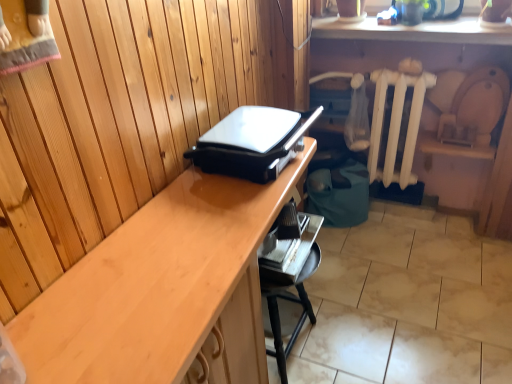
Where is `metallic silver tray at lower center`? The width and height of the screenshot is (512, 384). metallic silver tray at lower center is located at coordinates (289, 280).

This screenshot has height=384, width=512. Find the location of `wooden desk at center`. wooden desk at center is located at coordinates click(164, 291).

I want to click on white painted wood radiator at center right, so click(x=396, y=124).

Describe the element at coordinates (396, 124) in the screenshot. I see `white painted wood radiator at center right` at that location.

The image size is (512, 384). Identify the location of metallic silver tray at lower center. (289, 280).

Who is more distant, wooden desk at center or black plastic grill at center?

black plastic grill at center is behind.

Is wooden desk at center inside the boundaries of black plastic grill at center, or outside?

wooden desk at center cannot be found inside black plastic grill at center.

Considering the relative sizes of wooden desk at center and black plastic grill at center in the image provided, is wooden desk at center bigger than black plastic grill at center?

Correct, wooden desk at center is larger in size than black plastic grill at center.

Are wooden desk at center and black plastic grill at center located far from each other?

No, wooden desk at center is in close proximity to black plastic grill at center.

Can you confirm if metallic silver tray at lower center is smaller than black plastic grill at center?

Incorrect, metallic silver tray at lower center is not smaller in size than black plastic grill at center.

This screenshot has width=512, height=384. In order to click on furniture below the black plastic grill at center (from the image's perspective) in this screenshot , I will do `click(289, 280)`.

Is metallic silver tray at lower center spatially inside black plastic grill at center, or outside of it?

The correct answer is: outside.

How distant is metallic silver tray at lower center from black plastic grill at center?

metallic silver tray at lower center is 16.32 inches away from black plastic grill at center.

Is metallic silver tray at lower center not near white painted wood radiator at center right?

metallic silver tray at lower center is near white painted wood radiator at center right, not far away.

Considering the relative positions of metallic silver tray at lower center and white painted wood radiator at center right in the image provided, is metallic silver tray at lower center behind white painted wood radiator at center right?

No.

From a real-world perspective, which is physically above, metallic silver tray at lower center or white painted wood radiator at center right?

white painted wood radiator at center right.

Which is more to the left, metallic silver tray at lower center or white painted wood radiator at center right?

metallic silver tray at lower center is more to the left.

Based on the photo, is white painted wood radiator at center right not close to wooden desk at center?

Yes, white painted wood radiator at center right and wooden desk at center are located far from each other.

From the picture: Considering the sizes of objects white painted wood radiator at center right and wooden desk at center in the image provided, who is wider, white painted wood radiator at center right or wooden desk at center?

wooden desk at center.

From a real-world perspective, which is physically below, white painted wood radiator at center right or wooden desk at center?

wooden desk at center, from a real-world perspective.

Does point (397, 176) come farther from viewer compared to point (93, 255)?

Yes, it is.

Does point (421, 110) appear closer or farther from the camera than point (282, 276)?

Point (421, 110) is farther from the camera than point (282, 276).

Measure the distance between white painted wood radiator at center right and metallic silver tray at lower center.

white painted wood radiator at center right and metallic silver tray at lower center are 33.04 inches apart from each other.

From a real-world perspective, is white painted wood radiator at center right physically located above or below metallic silver tray at lower center?

Clearly, from a real-world perspective, white painted wood radiator at center right is above metallic silver tray at lower center.

Could you tell me if white painted wood radiator at center right is turned towards metallic silver tray at lower center?

Yes, white painted wood radiator at center right faces towards metallic silver tray at lower center.

From the picture: Does wooden desk at center turn towards white painted wood radiator at center right?

No, wooden desk at center does not turn towards white painted wood radiator at center right.

Considering the positions of point (220, 309) and point (393, 153), is point (220, 309) closer or farther from the camera than point (393, 153)?

Point (220, 309) appears to be closer to the viewer than point (393, 153).

Is wooden desk at center placed right next to white painted wood radiator at center right?

No, wooden desk at center is not beside white painted wood radiator at center right.

From a real-world perspective, between black plastic grill at center and white painted wood radiator at center right, who is vertically lower?

white painted wood radiator at center right.

Considering the positions of objects black plastic grill at center and white painted wood radiator at center right in the image provided, who is in front, black plastic grill at center or white painted wood radiator at center right?

black plastic grill at center is more forward.

Which object is thinner, black plastic grill at center or white painted wood radiator at center right?

With smaller width is white painted wood radiator at center right.

There is a white painted wood radiator at center right. At what (x,y) coordinates should I click in order to perform the action: click on appliance above it (from a real-world perspective). Please return your answer as a coordinate pair (x, y). Looking at the image, I should click on (253, 142).

Image resolution: width=512 pixels, height=384 pixels. In order to click on appliance that appears above the wooden desk at center (from the image's perspective) in this screenshot , I will do `click(253, 142)`.

Locate an element on the screen. The width and height of the screenshot is (512, 384). appliance above the metallic silver tray at lower center (from a real-world perspective) is located at coordinates (253, 142).

Based on their spatial positions, is wooden desk at center or black plastic grill at center closer to metallic silver tray at lower center?

Among the two, wooden desk at center is located nearer to metallic silver tray at lower center.

Which object lies further to the anchor point black plastic grill at center, white painted wood radiator at center right or wooden desk at center?

white painted wood radiator at center right lies further to black plastic grill at center than the other object.

From the image, which object appears to be farther from white painted wood radiator at center right, metallic silver tray at lower center or wooden desk at center?

wooden desk at center.

Looking at the image, which one is located further to white painted wood radiator at center right, metallic silver tray at lower center or black plastic grill at center?

Based on the image, black plastic grill at center appears to be further to white painted wood radiator at center right.

Estimate the real-world distances between objects in this image. Which object is further from white painted wood radiator at center right, wooden desk at center or metallic silver tray at lower center?

Based on the image, wooden desk at center appears to be further to white painted wood radiator at center right.

Which object lies further to the anchor point white painted wood radiator at center right, black plastic grill at center or wooden desk at center?

wooden desk at center is positioned further to the anchor white painted wood radiator at center right.

Looking at the image, which one is located further to black plastic grill at center, wooden desk at center or white painted wood radiator at center right?

Based on the image, white painted wood radiator at center right appears to be further to black plastic grill at center.

Based on the photo, from the image, which object appears to be nearer to metallic silver tray at lower center, black plastic grill at center or wooden desk at center?

wooden desk at center is positioned closer to the anchor metallic silver tray at lower center.

Where is `desk between black plastic grill at center and metallic silver tray at lower center in the vertical direction`? Image resolution: width=512 pixels, height=384 pixels. desk between black plastic grill at center and metallic silver tray at lower center in the vertical direction is located at coordinates (164, 291).

This screenshot has width=512, height=384. I want to click on appliance between wooden desk at center and white painted wood radiator at center right from front to back, so click(x=253, y=142).

The width and height of the screenshot is (512, 384). Find the location of `furniture between wooden desk at center and white painted wood radiator at center right in the front-back direction`. furniture between wooden desk at center and white painted wood radiator at center right in the front-back direction is located at coordinates (x=289, y=280).

I want to click on furniture between black plastic grill at center and white painted wood radiator at center right from front to back, so click(x=289, y=280).